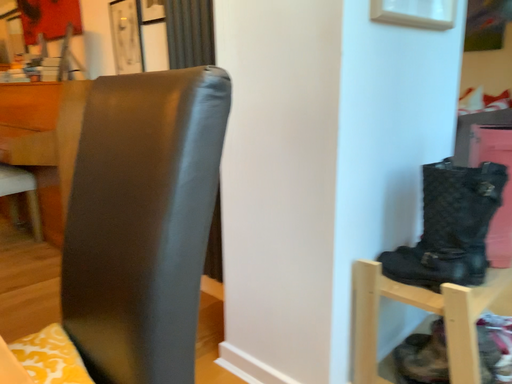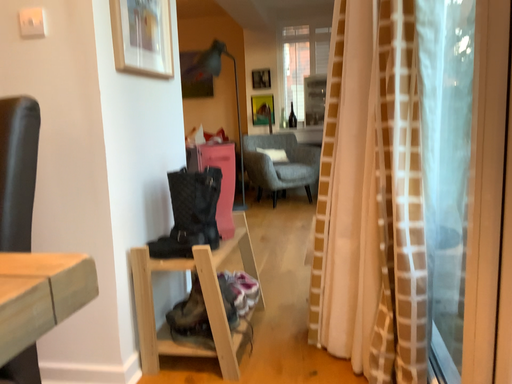
Question: Which way did the camera rotate in the video?

Choices:
 (A) rotated right
 (B) rotated left

Answer: (A)